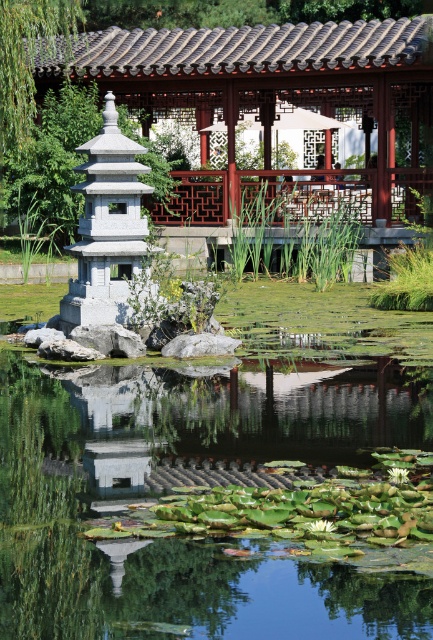
Which is below, green glossy pond at center or wooden lattice gazebo at upper center?

green glossy pond at center is lower down.

Is green glossy pond at center to the left of wooden lattice gazebo at upper center from the viewer's perspective?

Indeed, green glossy pond at center is positioned on the left side of wooden lattice gazebo at upper center.

Which is in front, point (397, 600) or point (387, 28)?

Point (397, 600) is in front.

The width and height of the screenshot is (433, 640). What are the coordinates of `green glossy pond at center` in the screenshot? It's located at (190, 486).